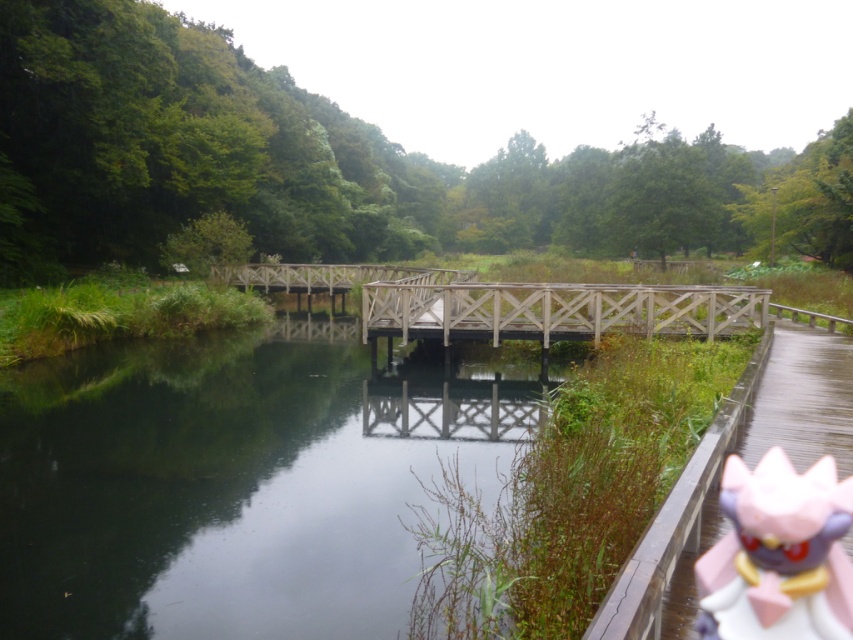
You are standing on the wooden bridge at center and want to see your reflection in the dark reflective water at center. Can you see your reflection clearly?

The dark reflective water at center is shorter than wooden bridge at center, so yes, you can see your reflection clearly because the water is deep enough to reflect the bridge and surroundings.

From the picture: You are a photographer trying to capture both the pink plastic doll at lower right and the wooden bridge at center in a single shot. Given that the doll is smaller than the bridge, where should you position the camera to ensure both are clearly visible in the frame?

To capture both the pink plastic doll at lower right and the wooden bridge at center clearly, position the camera closer to the pink plastic doll at lower right. This will make the doll appear larger in the frame while still including the wooden bridge at center in the background.